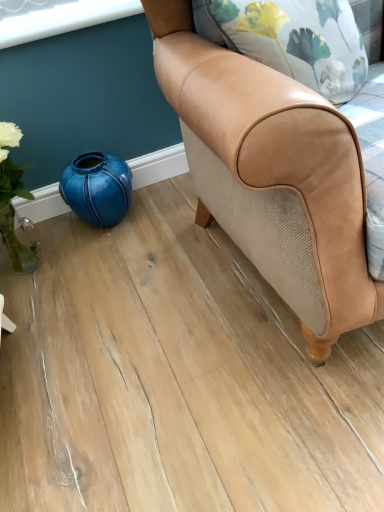
Question: Considering the positions of teal glossy vase at lower left and tan leather chair at center in the image, is teal glossy vase at lower left bigger or smaller than tan leather chair at center?

Choices:
 (A) small
 (B) big

Answer: (A)

Question: From the image's perspective, is teal glossy vase at lower left positioned above or below tan leather chair at center?

Choices:
 (A) above
 (B) below

Answer: (B)

Question: In terms of width, does teal glossy vase at lower left look wider or thinner when compared to tan leather chair at center?

Choices:
 (A) thin
 (B) wide

Answer: (A)

Question: From their relative heights in the image, would you say tan leather chair at center is taller or shorter than teal glossy vase at lower left?

Choices:
 (A) short
 (B) tall

Answer: (B)

Question: From a real-world perspective, is tan leather chair at center positioned above or below teal glossy vase at lower left?

Choices:
 (A) below
 (B) above

Answer: (B)

Question: Relative to teal glossy vase at lower left, is tan leather chair at center in front or behind?

Choices:
 (A) front
 (B) behind

Answer: (A)

Question: Looking at their shapes, would you say tan leather chair at center is wider or thinner than teal glossy vase at lower left?

Choices:
 (A) wide
 (B) thin

Answer: (A)